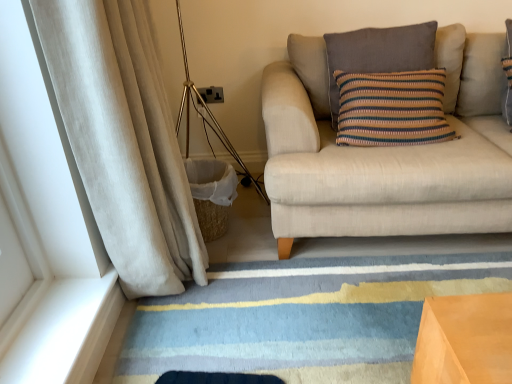
Question: Looking at their shapes, would you say knitted cotton pillow at upper right is wider or thinner than beige corduroy curtain at left?

Choices:
 (A) thin
 (B) wide

Answer: (A)

Question: Is point (426, 24) positioned closer to the camera than point (66, 112)?

Choices:
 (A) closer
 (B) farther

Answer: (B)

Question: Estimate the real-world distances between objects in this image. Which object is farther from the striped wool rug at lower center?

Choices:
 (A) beige corduroy curtain at left
 (B) gold metallic tripod lamp at left
 (C) knitted cotton pillow at upper right
 (D) beige fabric couch at right

Answer: (C)

Question: Considering the real-world distances, which object is closest to the beige fabric couch at right?

Choices:
 (A) knitted cotton pillow at upper right
 (B) striped wool rug at lower center
 (C) beige corduroy curtain at left
 (D) gold metallic tripod lamp at left

Answer: (A)